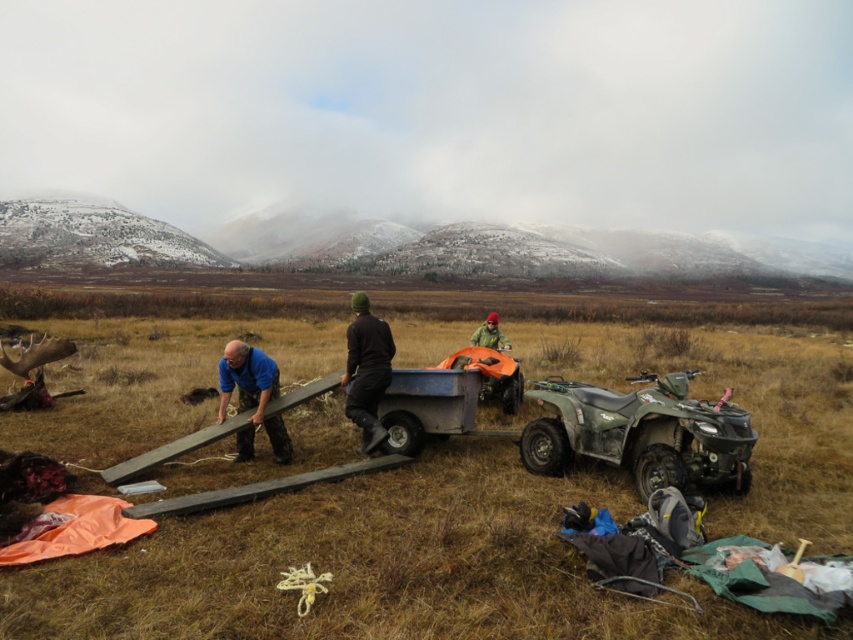
Does wooden plank at center have a lesser height compared to black matte jacket at center?

No, wooden plank at center is not shorter than black matte jacket at center.

Can you confirm if wooden plank at center is thinner than black matte jacket at center?

In fact, wooden plank at center might be wider than black matte jacket at center.

Where is `wooden plank at center`? The width and height of the screenshot is (853, 640). wooden plank at center is located at coordinates (376, 564).

The height and width of the screenshot is (640, 853). Find the location of `wooden plank at center`. wooden plank at center is located at coordinates (376, 564).

Between point (274, 440) and point (474, 346), which one is positioned in front?

Point (274, 440) is more forward.

Is point (234, 348) positioned before point (473, 344)?

Yes, it is in front of point (473, 344).

This screenshot has width=853, height=640. I want to click on blue fabric shirt at left, so click(x=252, y=397).

Which is below, black matte jacket at center or green matte jacket at center?

black matte jacket at center is lower down.

Does black matte jacket at center have a greater height compared to green matte jacket at center?

No, black matte jacket at center is not taller than green matte jacket at center.

Find the location of a particular element. The image size is (853, 640). black matte jacket at center is located at coordinates (366, 371).